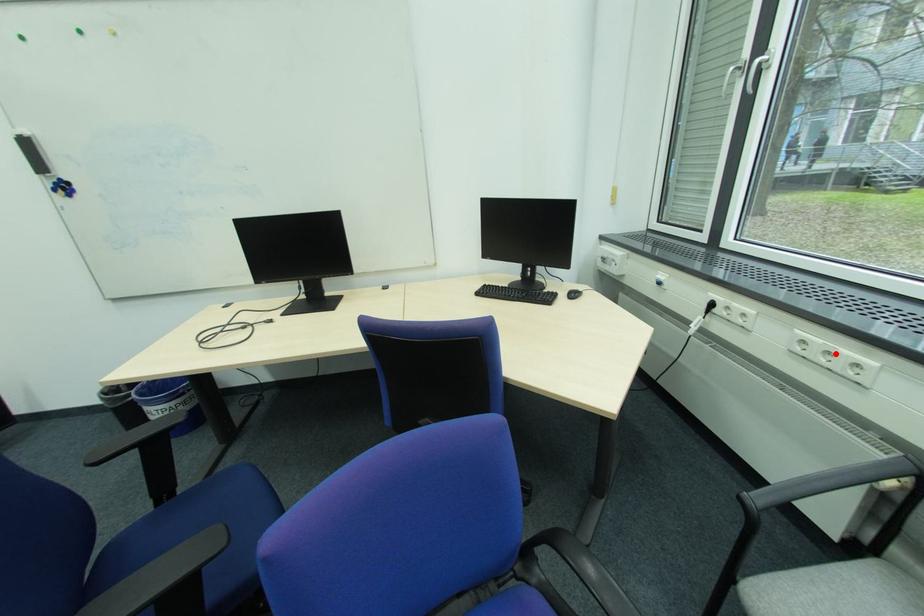
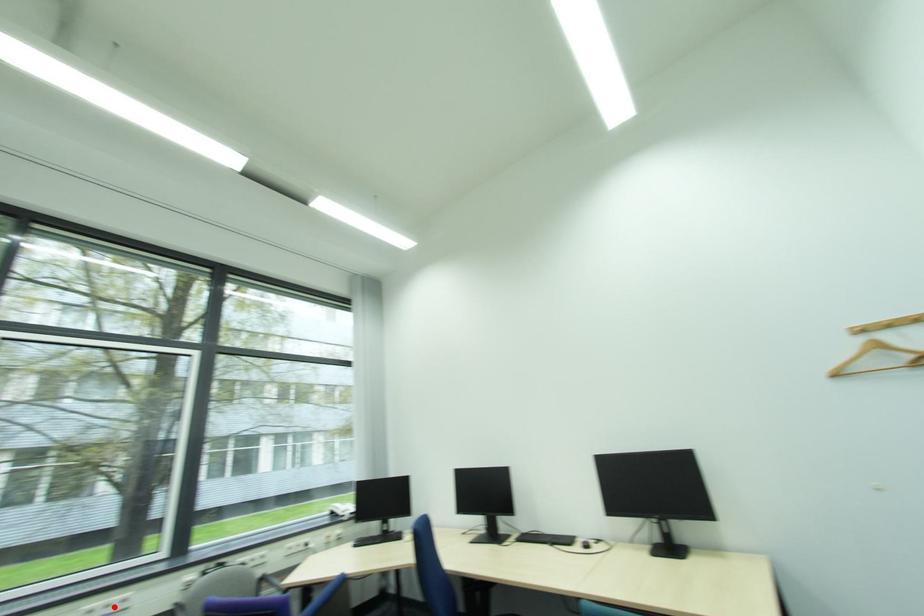
I am providing you with two images of the same scene from different viewpoints. A red point is marked on the first image and another point is marked on the second image. Is the red point in image1 aligned with the point shown in image2?

Yes